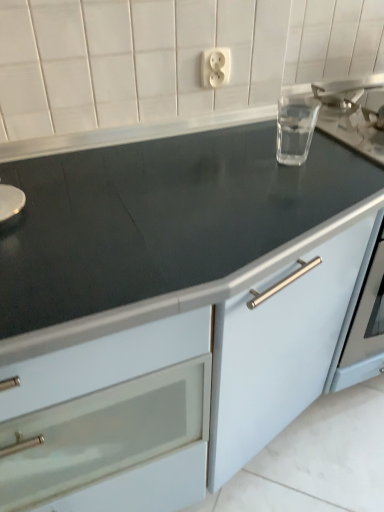
Describe the element at coordinates (215, 67) in the screenshot. This screenshot has height=512, width=384. I see `white plastic outlet at upper center` at that location.

Identify the location of transparent glass at upper right. The height and width of the screenshot is (512, 384). (295, 128).

This screenshot has height=512, width=384. Identify the location of white plastic outlet at upper center. (215, 67).

Is matte white cabinet at center beside transparent glass at upper right?

matte white cabinet at center and transparent glass at upper right are not in contact.

Is matte white cabinet at center closer to the viewer compared to transparent glass at upper right?

Yes, matte white cabinet at center is in front of transparent glass at upper right.

From a real-world perspective, is matte white cabinet at center located higher than transparent glass at upper right?

Incorrect, from a real-world perspective, matte white cabinet at center is lower than transparent glass at upper right.

In terms of width, does matte white cabinet at center look wider or thinner when compared to transparent glass at upper right?

In the image, matte white cabinet at center appears to be wider than transparent glass at upper right.

From the image's perspective, is white plastic outlet at upper center located above or below transparent glass at upper right?

white plastic outlet at upper center is situated higher than transparent glass at upper right in the image.

Who is bigger, white plastic outlet at upper center or transparent glass at upper right?

With larger size is transparent glass at upper right.

Is white plastic outlet at upper center placed right next to transparent glass at upper right?

white plastic outlet at upper center and transparent glass at upper right are not in contact.

Can you confirm if white plastic outlet at upper center is wider than transparent glass at upper right?

In fact, white plastic outlet at upper center might be narrower than transparent glass at upper right.

How many degrees apart are the facing directions of transparent glass at upper right and matte white cabinet at center?

The angle between the facing direction of transparent glass at upper right and the facing direction of matte white cabinet at center is 0.142 degrees.

From a real-world perspective, is transparent glass at upper right physically located above or below matte white cabinet at center?

From a real-world perspective, transparent glass at upper right is physically above matte white cabinet at center.

From the picture: Which is more to the left, transparent glass at upper right or matte white cabinet at center?

matte white cabinet at center.

Is transparent glass at upper right taller than matte white cabinet at center?

Incorrect, the height of transparent glass at upper right is not larger of that of matte white cabinet at center.

Which object is thinner, matte white cabinet at center or white plastic outlet at upper center?

white plastic outlet at upper center is thinner.

Which point is more forward, (88, 384) or (214, 68)?

Positioned in front is point (88, 384).

Based on their positions, is matte white cabinet at center located to the left or right of white plastic outlet at upper center?

Based on their positions, matte white cabinet at center is located to the left of white plastic outlet at upper center.

Locate an element on the screen. electric outlet above the matte white cabinet at center (from the image's perspective) is located at coordinates (215, 67).

From a real-world perspective, is white plastic outlet at upper center positioned over matte white cabinet at center based on gravity?

Yes, from a real-world perspective, white plastic outlet at upper center is above matte white cabinet at center.

Would you consider white plastic outlet at upper center to be distant from matte white cabinet at center?

No, white plastic outlet at upper center is in close proximity to matte white cabinet at center.

Between white plastic outlet at upper center and matte white cabinet at center, which one has larger width?

With larger width is matte white cabinet at center.

From the image's perspective, between white plastic outlet at upper center and matte white cabinet at center, which one is located above?

From the image's view, white plastic outlet at upper center is above.

How far apart are transparent glass at upper right and white plastic outlet at upper center?

transparent glass at upper right is 23.06 centimeters away from white plastic outlet at upper center.

Which point is more distant from viewer, (300, 163) or (205, 59)?

A: Point (205, 59)

Can you confirm if transparent glass at upper right is wider than white plastic outlet at upper center?

Correct, the width of transparent glass at upper right exceeds that of white plastic outlet at upper center.

Where is `appliance that appears on the right of matte white cabinet at center`? appliance that appears on the right of matte white cabinet at center is located at coordinates (295, 128).

Find the location of `electric outlet above the transparent glass at upper right (from the image's perspective)`. electric outlet above the transparent glass at upper right (from the image's perspective) is located at coordinates (215, 67).

Estimate the real-world distances between objects in this image. Which object is closer to white plastic outlet at upper center, matte white cabinet at center or transparent glass at upper right?

transparent glass at upper right.

Considering their positions, is transparent glass at upper right positioned closer to white plastic outlet at upper center than matte white cabinet at center?

transparent glass at upper right is closer to white plastic outlet at upper center.

Considering their positions, is transparent glass at upper right positioned further to matte white cabinet at center than white plastic outlet at upper center?

white plastic outlet at upper center lies further to matte white cabinet at center than the other object.

Estimate the real-world distances between objects in this image. Which object is closer to transparent glass at upper right, matte white cabinet at center or white plastic outlet at upper center?

white plastic outlet at upper center lies closer to transparent glass at upper right than the other object.

Considering their positions, is white plastic outlet at upper center positioned closer to matte white cabinet at center than transparent glass at upper right?

Among the two, transparent glass at upper right is located nearer to matte white cabinet at center.

Estimate the real-world distances between objects in this image. Which object is closer to transparent glass at upper right, white plastic outlet at upper center or matte white cabinet at center?

white plastic outlet at upper center is closer to transparent glass at upper right.

Locate an element on the screen. The width and height of the screenshot is (384, 512). appliance between white plastic outlet at upper center and matte white cabinet at center vertically is located at coordinates (295, 128).